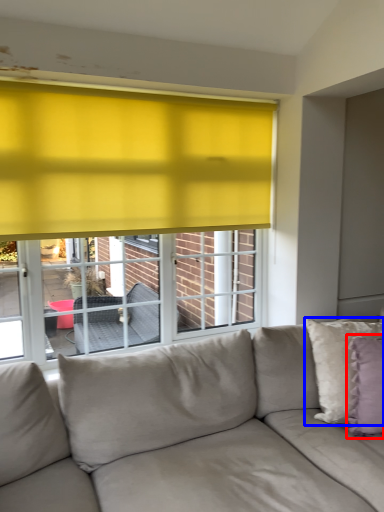
Question: Which object appears closest to the camera in this image, pillow (highlighted by a red box) or pillow (highlighted by a blue box)?

Choices:
 (A) pillow
 (B) pillow

Answer: (A)